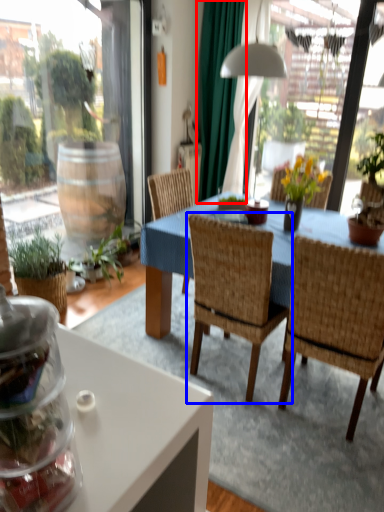
Question: Among these objects, which one is nearest to the camera, curtain (highlighted by a red box) or chair (highlighted by a blue box)?

Choices:
 (A) curtain
 (B) chair

Answer: (B)